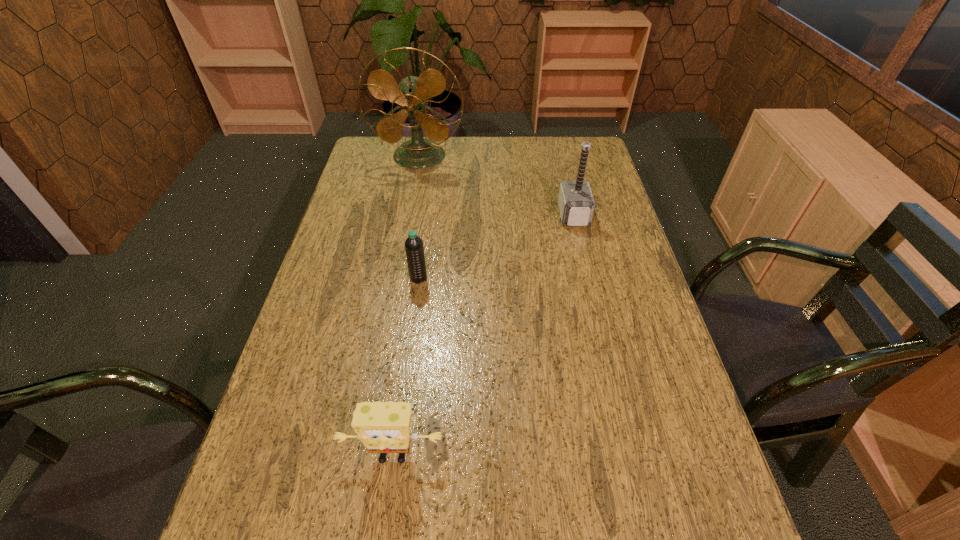
Where is `free location located 0.060m on the right of the water bottle`? free location located 0.060m on the right of the water bottle is located at coordinates (449, 278).

The image size is (960, 540). I want to click on free space located on the face of the nearest object, so (x=386, y=503).

Image resolution: width=960 pixels, height=540 pixels. I want to click on object that is at the far edge, so click(412, 95).

Identify the location of object that is at the left edge. pyautogui.click(x=412, y=95).

At what (x,y) coordinates should I click in order to perform the action: click on object that is at the right edge. Please return your answer as a coordinate pair (x, y). The width and height of the screenshot is (960, 540). Looking at the image, I should click on (576, 204).

This screenshot has width=960, height=540. Find the location of `object that is at the far left corner`. object that is at the far left corner is located at coordinates (412, 95).

Locate an element on the screen. The width and height of the screenshot is (960, 540). vacant space at the far edge of the desktop is located at coordinates (470, 148).

The height and width of the screenshot is (540, 960). Find the location of `vacant area at the left edge of the desktop`. vacant area at the left edge of the desktop is located at coordinates (389, 212).

Locate an element on the screen. vacant position at the right edge of the desktop is located at coordinates (572, 173).

Locate an element on the screen. Image resolution: width=960 pixels, height=540 pixels. free point at the far left corner is located at coordinates (380, 152).